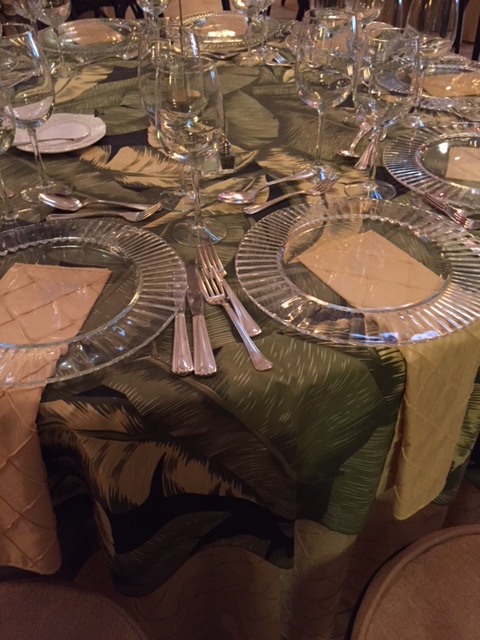
Where is `floor`? This screenshot has width=480, height=640. floor is located at coordinates (195, 6).